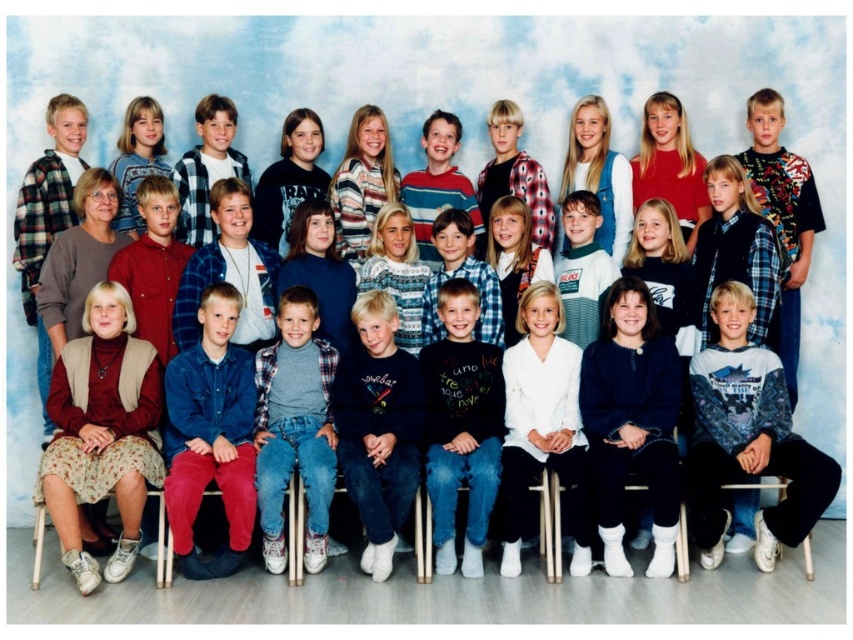
Question: Can you confirm if denim shirt at center is thinner than white fleece sweater at upper center?

Choices:
 (A) no
 (B) yes

Answer: (A)

Question: Which object is positioned closest to the white cotton shirt at center?

Choices:
 (A) denim jeans at center
 (B) matte red shirt at upper right
 (C) striped sweater at center

Answer: (B)

Question: Estimate the real-world distances between objects in this image. Which object is farther from the matte red shirt at upper right?

Choices:
 (A) floral skirt at lower left
 (B) dark blue jeans at center
 (C) white cotton shirt at center

Answer: (A)

Question: Among these objects, which one is nearest to the camera?

Choices:
 (A) white cotton shirt at center
 (B) white fleece sweater at upper center
 (C) dark blue sweater at center

Answer: (A)

Question: Is denim shirt at center smaller than matte red shirt at upper right?

Choices:
 (A) no
 (B) yes

Answer: (A)

Question: Does dark blue sweater at center have a greater width compared to matte red shirt at upper right?

Choices:
 (A) no
 (B) yes

Answer: (B)